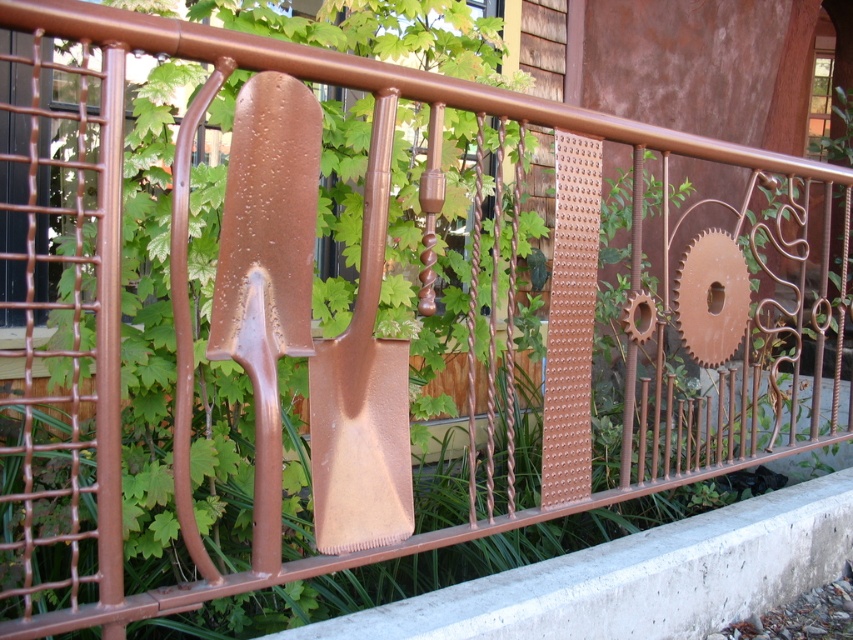
Who is lower down, rusty metal shovel at center or brown matte shovel at center?

rusty metal shovel at center

Can you confirm if rusty metal shovel at center is wider than brown matte shovel at center?

Indeed, rusty metal shovel at center has a greater width compared to brown matte shovel at center.

Between point (218, 260) and point (358, 534), which one is positioned behind?

The point (358, 534) is behind.

Find the location of `rusty metal shovel at center`. rusty metal shovel at center is located at coordinates (267, 269).